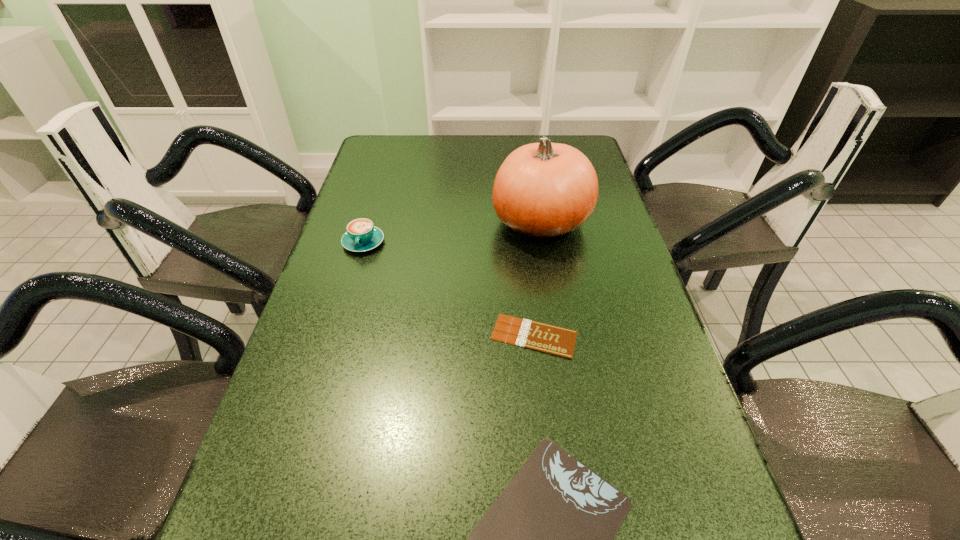
Identify the location of free space that is in between the pumpkin and the second shortest object. (538, 279).

This screenshot has width=960, height=540. I want to click on blank region between the leftmost object and the tallest object, so click(x=452, y=232).

The height and width of the screenshot is (540, 960). I want to click on object that is the closest to the pumpkin, so click(x=559, y=341).

Identify which object is located as the second nearest to the cappuccino. Please provide its 2D coordinates. Your answer should be formatted as a tuple, i.e. [(x, y)], where the tuple contains the x and y coordinates of a point satisfying the conditions above.

[(559, 341)]

Find the location of a particular element. This screenshot has height=540, width=960. free space that satisfies the following two spatial constraints: 1. with the handle on the right side of the third shortest object; 2. on the left side of the third farthest object is located at coordinates (336, 336).